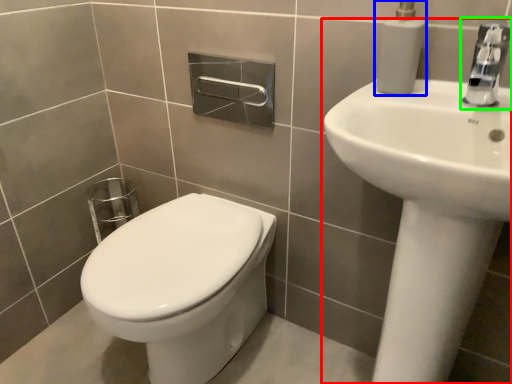
Question: Based on their relative distances, which object is farther from sink (highlighted by a red box)? Choose from soap dispenser (highlighted by a blue box) and tap (highlighted by a green box).

Choices:
 (A) soap dispenser
 (B) tap

Answer: (A)